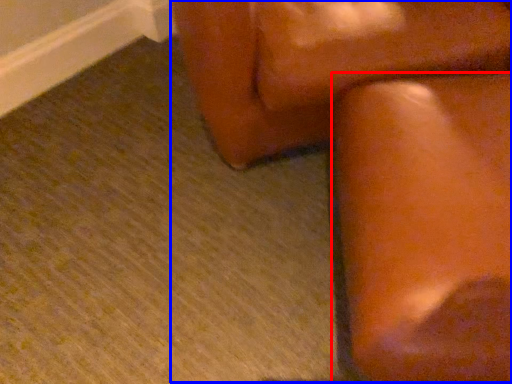
Question: Which of the following is the closest to the observer, furniture (highlighted by a red box) or rocking chair (highlighted by a blue box)?

Choices:
 (A) furniture
 (B) rocking chair

Answer: (A)